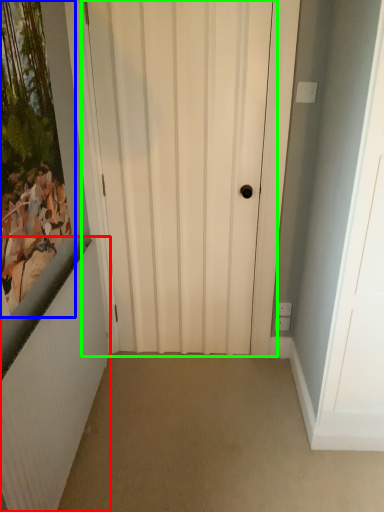
Question: Which object is positioned farthest from radiator (highlighted by a red box)? Select from picture frame (highlighted by a blue box) and door (highlighted by a green box).

Choices:
 (A) picture frame
 (B) door

Answer: (B)